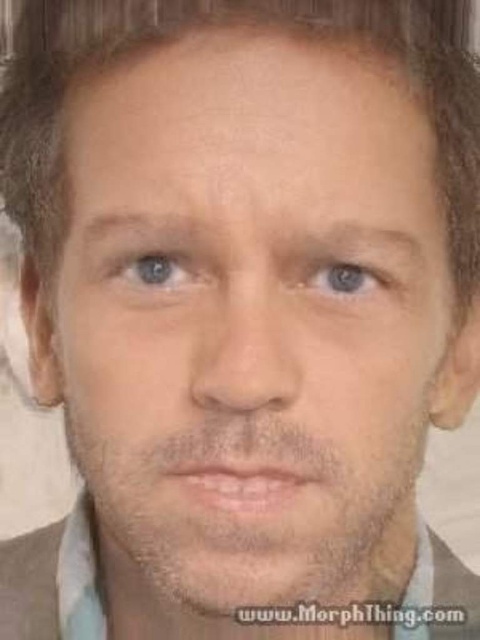
Is blue matte eye at upper left positioned in front of blue matte eye at center?

Yes.

Who is lower down, blue matte eye at upper left or blue matte eye at center?

Positioned lower is blue matte eye at center.

The image size is (480, 640). In order to click on blue matte eye at upper left in this screenshot , I will do `click(156, 269)`.